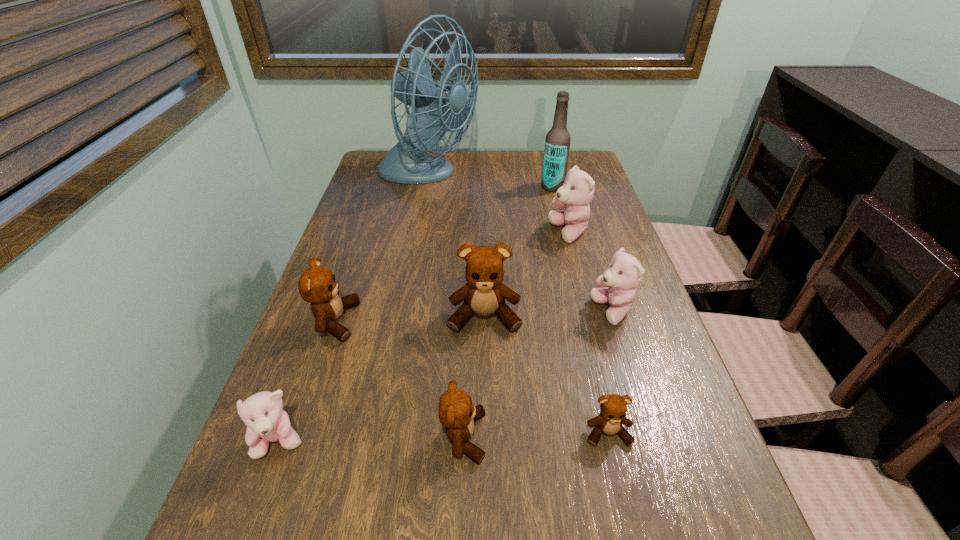
Image resolution: width=960 pixels, height=540 pixels. I want to click on free spot that satisfies the following two spatial constraints: 1. on the front-facing side of the biggest brown teddy bear; 2. on the front-facing side of the second smallest brown teddy bear, so click(486, 437).

Image resolution: width=960 pixels, height=540 pixels. Find the location of `free point that satisfies the following two spatial constraints: 1. at the face of the second smallest pink teddy bear; 2. on the front-facing side of the rightmost brown teddy bear`. free point that satisfies the following two spatial constraints: 1. at the face of the second smallest pink teddy bear; 2. on the front-facing side of the rightmost brown teddy bear is located at coordinates pos(651,433).

Locate an element on the screen. This screenshot has width=960, height=540. free space that satisfies the following two spatial constraints: 1. at the face of the second nearest pink teddy bear; 2. on the front-facing side of the biggest brown teddy bear is located at coordinates (613, 316).

Where is `free spot that satisfies the following two spatial constraints: 1. at the face of the farthest teddy bear; 2. on the front-facing side of the biggest brown teddy bear`? free spot that satisfies the following two spatial constraints: 1. at the face of the farthest teddy bear; 2. on the front-facing side of the biggest brown teddy bear is located at coordinates (590, 316).